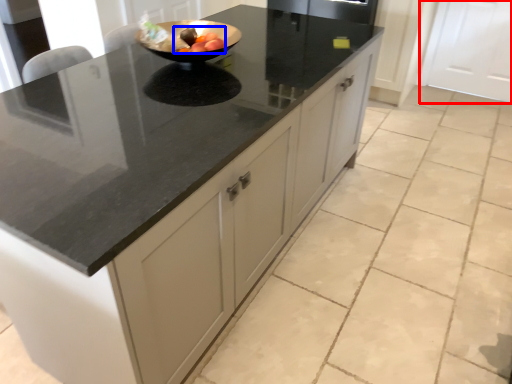
Question: Among these objects, which one is farthest to the camera, cabinetry (highlighted by a red box) or fruit (highlighted by a blue box)?

Choices:
 (A) cabinetry
 (B) fruit

Answer: (A)